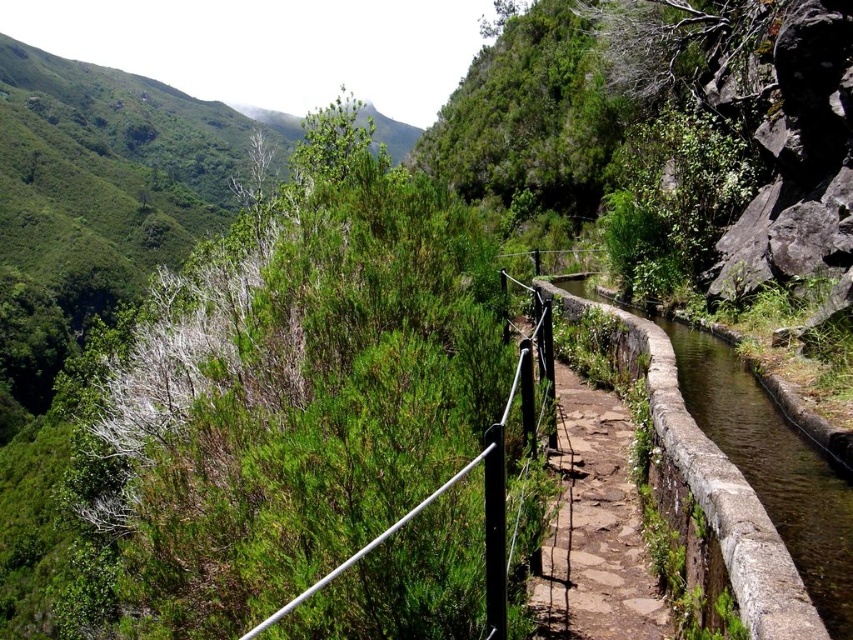
You are a hiker carrying a backpack and need to cross the path. The smooth stone canal at center is in your way. Can you step over it without getting your shoes wet?

The smooth stone canal at center is 4.20 meters away from you, so you can easily step over it without getting your shoes wet.

You are a hiker standing on the narrow stone pathway. You notice the smooth stone canal at center and the black metal rail at upper center. Which object is closer to you?

The smooth stone canal at center is closer to you since it is shorter than the black metal rail at upper center, meaning it is positioned nearer along the path.

You are a hiker walking along the narrow stone path and notice the smooth stone canal at center and the black metal rail at upper center. Which object is located higher up in the scene?

The smooth stone canal at center is positioned over the black metal rail at upper center, so the smooth stone canal at center is higher up in the scene.